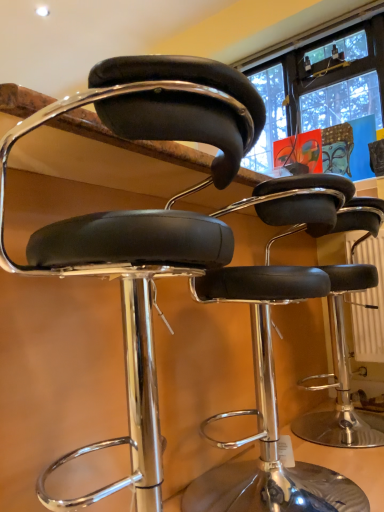
Question: Which direction should I rotate to face black leather stool at center, placed as the second chair when sorted from front to back, — up or down?

Choices:
 (A) down
 (B) up

Answer: (A)

Question: From a real-world perspective, is black leather stool at center, positioned as the second chair in back-to-front order, positioned under black leather stool at center, placed as the second chair when sorted from front to back, based on gravity?

Choices:
 (A) no
 (B) yes

Answer: (A)

Question: From the image's perspective, would you say black leather stool at center, positioned as the second chair in back-to-front order, is shown under black leather stool at center, the 1th chair when ordered from back to front?

Choices:
 (A) yes
 (B) no

Answer: (B)

Question: Does black leather stool at center, the first chair in the front-to-back sequence, have a greater height compared to black leather stool at center, the 1th chair when ordered from back to front?

Choices:
 (A) yes
 (B) no

Answer: (A)

Question: Is black leather stool at center, positioned as the second chair in back-to-front order, surrounding black leather stool at center, the 1th chair when ordered from back to front?

Choices:
 (A) no
 (B) yes

Answer: (A)

Question: Is black leather stool at center, the first chair in the front-to-back sequence, oriented away from black leather stool at center, the 1th chair when ordered from back to front?

Choices:
 (A) yes
 (B) no

Answer: (B)

Question: Considering the relative sizes of black leather stool at center, positioned as the second chair in back-to-front order, and black leather stool at center, the 1th chair when ordered from back to front, in the image provided, is black leather stool at center, positioned as the second chair in back-to-front order, thinner than black leather stool at center, the 1th chair when ordered from back to front,?

Choices:
 (A) no
 (B) yes

Answer: (B)

Question: From a real-world perspective, is black leather stool at center, the 1th chair when ordered from back to front, physically below black leather stool at center, the first chair in the front-to-back sequence?

Choices:
 (A) no
 (B) yes

Answer: (B)

Question: From a real-world perspective, is black leather stool at center, placed as the second chair when sorted from front to back, over black leather stool at center, positioned as the second chair in back-to-front order?

Choices:
 (A) yes
 (B) no

Answer: (B)

Question: From the image's perspective, is black leather stool at center, placed as the second chair when sorted from front to back, on top of black leather stool at center, the first chair in the front-to-back sequence?

Choices:
 (A) yes
 (B) no

Answer: (B)

Question: Is black leather stool at center, the first chair in the front-to-back sequence, at the back of black leather stool at center, placed as the second chair when sorted from front to back?

Choices:
 (A) yes
 (B) no

Answer: (B)

Question: Does black leather stool at center, placed as the second chair when sorted from front to back, have a greater width compared to black leather stool at center, positioned as the second chair in back-to-front order?

Choices:
 (A) no
 (B) yes

Answer: (B)

Question: Would you say black leather stool at center, the 1th chair when ordered from back to front, is outside black leather stool at center, positioned as the second chair in back-to-front order?

Choices:
 (A) yes
 (B) no

Answer: (A)

Question: In terms of size, does black leather stool at center, the 1th chair when ordered from back to front, appear bigger or smaller than black leather stool at center, positioned as the second chair in back-to-front order?

Choices:
 (A) small
 (B) big

Answer: (A)